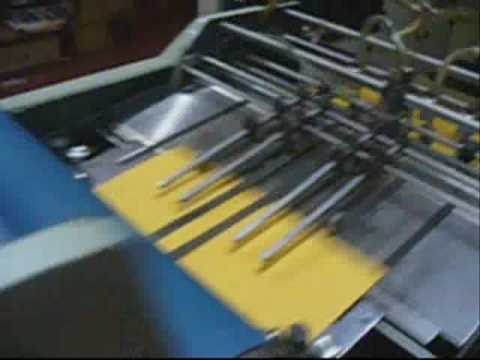
Where is `rod`? rod is located at coordinates (464, 72).